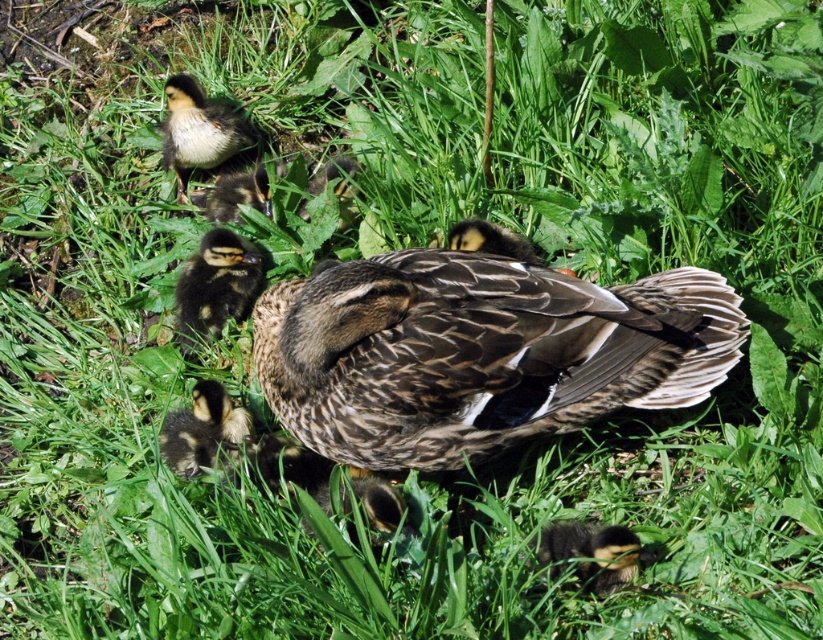
Question: Based on their relative distances, which object is nearer to the brown fuzzy duckling at center?

Choices:
 (A) speckled brown duckling at lower left
 (B) yellow downy duckling at upper left
 (C) dark brown fluffy duckling at lower right
 (D) dark brown fluffy duckling at center

Answer: (D)

Question: Which of the following is the farthest from the observer?

Choices:
 (A) brown fuzzy duckling at center
 (B) brown speckled duckling at upper center
 (C) yellow downy duckling at upper left

Answer: (C)

Question: Does yellow downy duckling at upper left appear under speckled brown duckling at lower left?

Choices:
 (A) yes
 (B) no

Answer: (B)

Question: Does dark brown fluffy duckling at lower right appear on the right side of brown fuzzy duckling at center?

Choices:
 (A) yes
 (B) no

Answer: (A)

Question: Does dark brown fluffy duckling at center appear over dark brown fluffy duckling at lower right?

Choices:
 (A) yes
 (B) no

Answer: (A)

Question: Among these points, which one is farthest from the camera?

Choices:
 (A) (352, 166)
 (B) (505, 307)
 (C) (594, 532)
 (D) (189, 435)

Answer: (A)